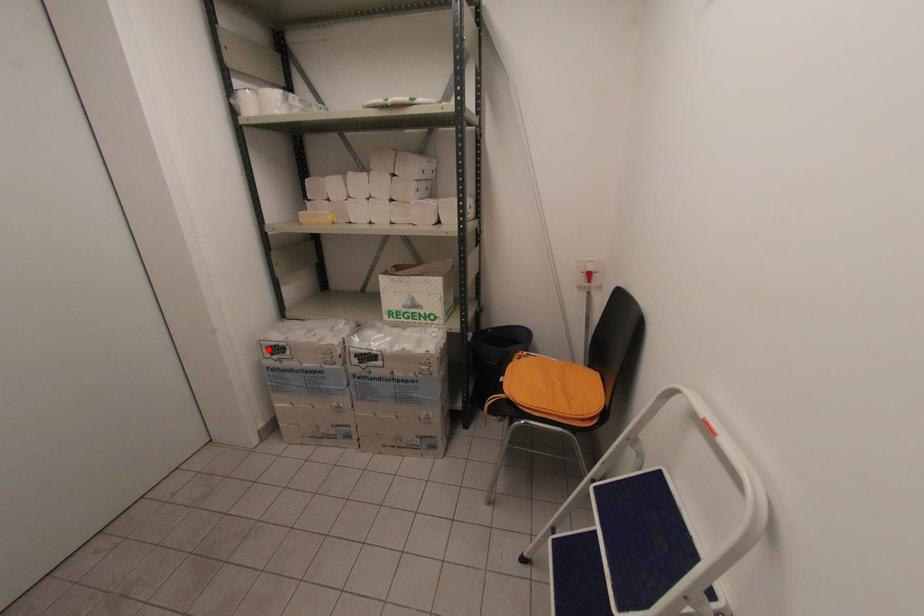
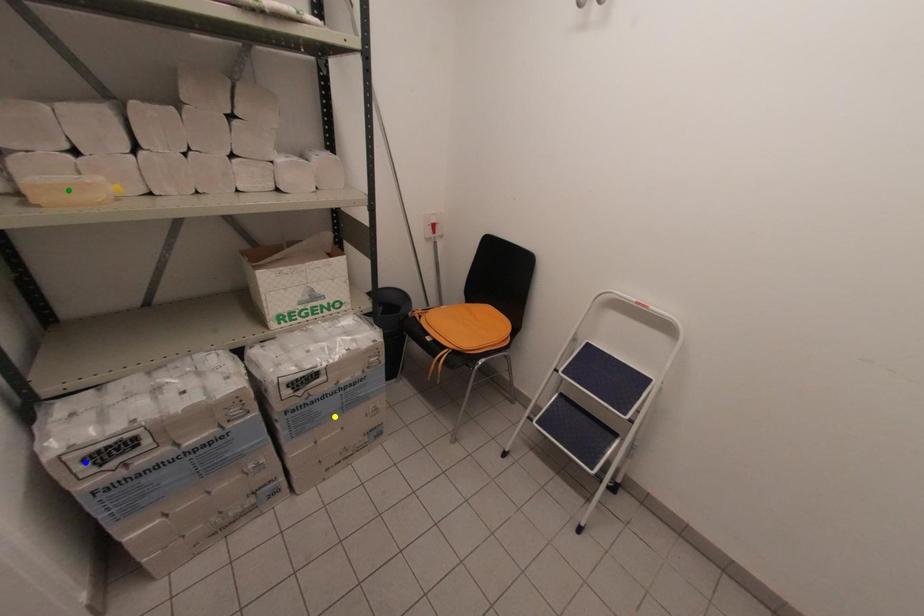
Question: I am providing you with two images of the same scene from different viewpoints. A red point is marked on the first image. You are given multiple points on the second image. Which point in image 2 represents the same 3d spot as the red point in image 1?

Choices:
 (A) green point
 (B) blue point
 (C) yellow point

Answer: (B)